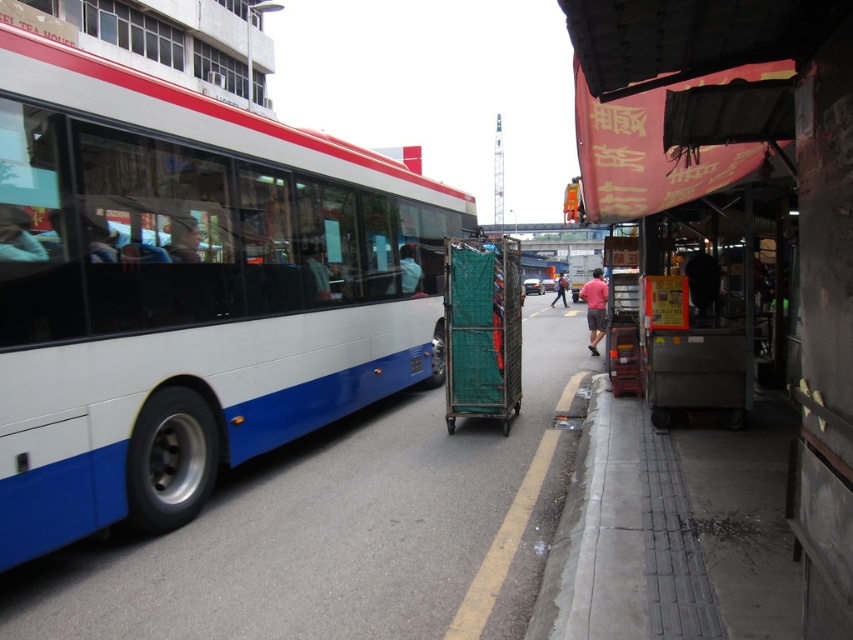
Who is positioned more to the right, green mesh cart at center or matte black shirt at center?

green mesh cart at center is more to the right.

Is green mesh cart at center positioned behind matte black shirt at center?

That is True.

What are the coordinates of `green mesh cart at center` in the screenshot? It's located at (482, 330).

The height and width of the screenshot is (640, 853). What do you see at coordinates (482, 330) in the screenshot?
I see `green mesh cart at center` at bounding box center [482, 330].

Which is more to the left, green mesh cart at center or matte blue shirt at center?

From the viewer's perspective, matte blue shirt at center appears more on the left side.

Between point (480, 340) and point (409, 250), which one is positioned in front?

Positioned in front is point (480, 340).

Identify the location of green mesh cart at center. (482, 330).

Does point (410, 176) lie in front of point (801, 364)?

No, (410, 176) is further to viewer.

This screenshot has width=853, height=640. What do you see at coordinates (184, 291) in the screenshot? I see `white glossy bus at left` at bounding box center [184, 291].

Where is `white glossy bus at left`? The image size is (853, 640). white glossy bus at left is located at coordinates (184, 291).